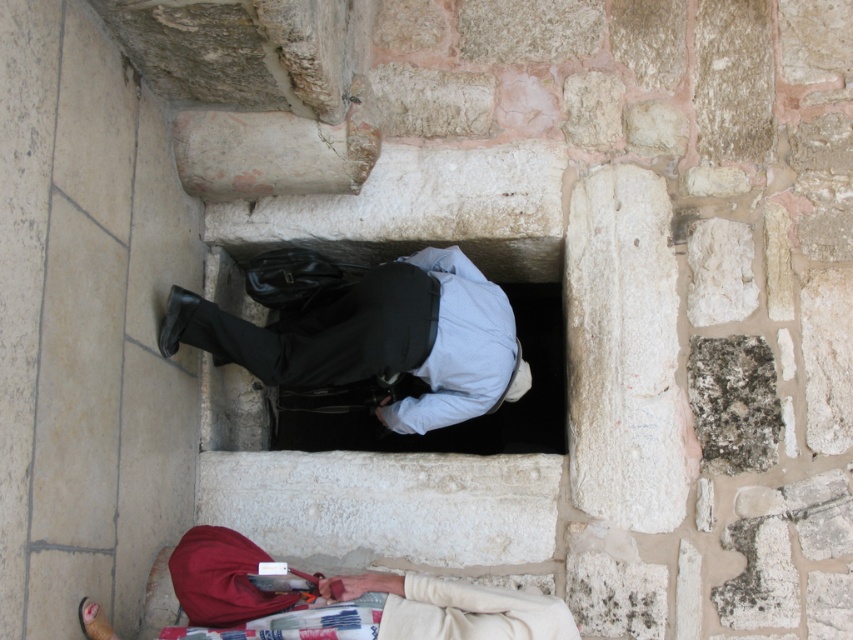
Can you confirm if light blue fabric shirt at center is positioned above beige fabric bag at lower center?

Yes.

Is point (161, 340) closer to camera compared to point (462, 586)?

No, (161, 340) is further to viewer.

Find the location of a particular element. light blue fabric shirt at center is located at coordinates (378, 339).